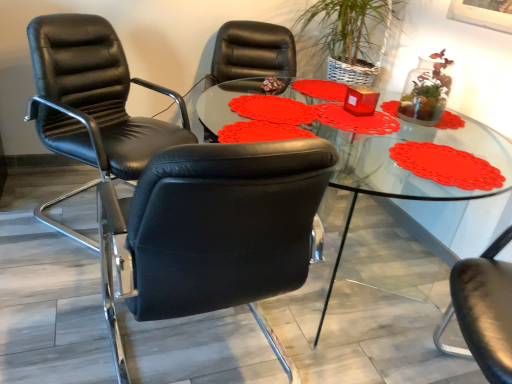
The height and width of the screenshot is (384, 512). I want to click on free space in front of black leather chair at left, which is the 2th chair from front to back, so click(x=53, y=287).